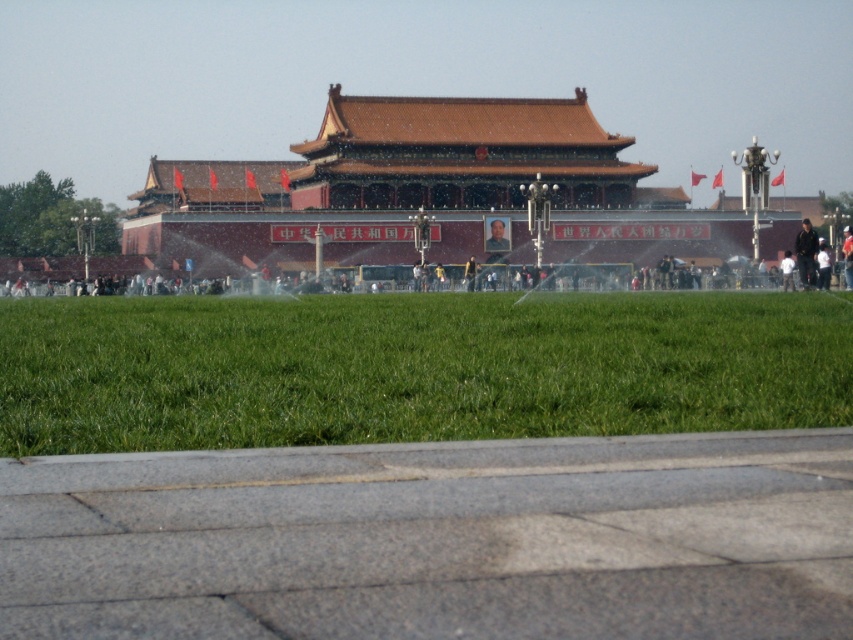
Question: Which of the following is the closest to the observer?

Choices:
 (A) (560, 118)
 (B) (811, 246)

Answer: (B)

Question: Is dark gray fabric jacket at right closer to camera compared to light brown leather jacket at right?

Choices:
 (A) yes
 (B) no

Answer: (A)

Question: Which object is positioned farthest from the light brown leather jacket at right?

Choices:
 (A) dark gray fabric jacket at right
 (B) brown wooden palace at center
 (C) green grass at center

Answer: (B)

Question: Does green grass at center have a greater width compared to dark gray fabric jacket at right?

Choices:
 (A) no
 (B) yes

Answer: (B)

Question: Does green grass at center appear on the right side of dark gray fabric jacket at right?

Choices:
 (A) yes
 (B) no

Answer: (B)

Question: Which point is closer to the camera taking this photo?

Choices:
 (A) (814, 234)
 (B) (846, 232)

Answer: (A)